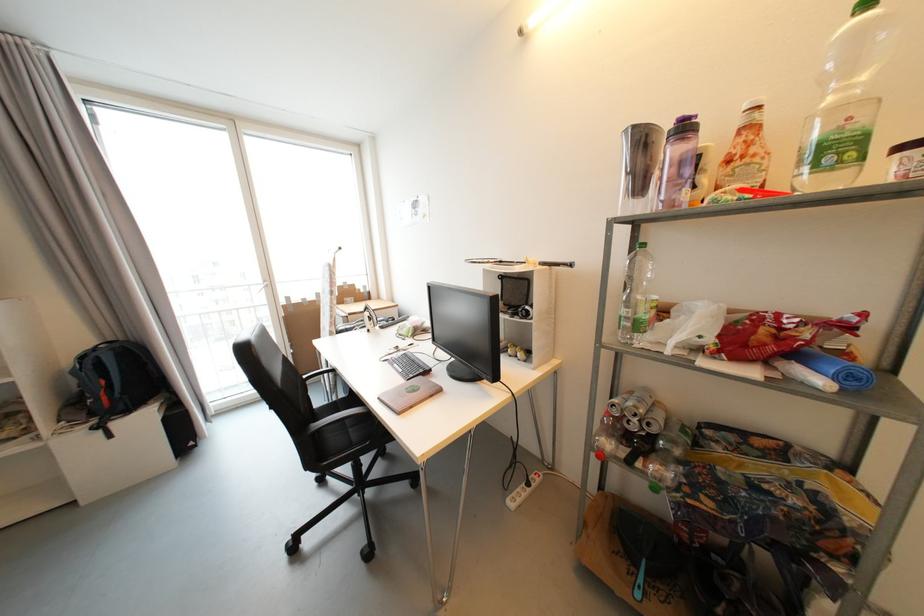
Describe the element at coordinates (264, 285) in the screenshot. I see `the white window handle` at that location.